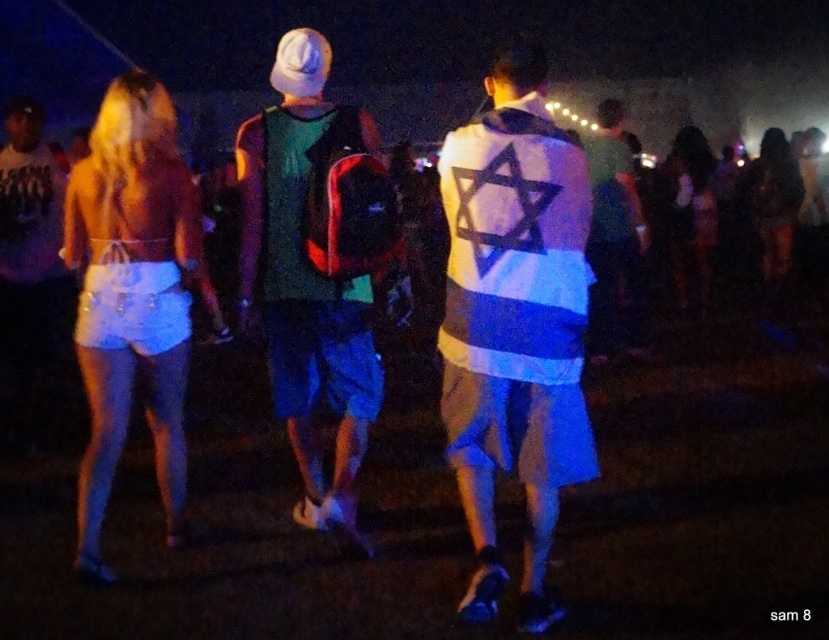
Question: Is white fabric vest at center smaller than white satin shorts at left?

Choices:
 (A) yes
 (B) no

Answer: (A)

Question: Which object appears farthest from the camera in this image?

Choices:
 (A) white satin shorts at left
 (B) green fabric shirt at center

Answer: (A)

Question: Can you confirm if green fabric shirt at center is positioned below white satin shorts at left?

Choices:
 (A) no
 (B) yes

Answer: (A)

Question: Which point is farther to the camera?

Choices:
 (A) white fabric vest at center
 (B) white satin shorts at left

Answer: (B)

Question: Can you confirm if white fabric vest at center is positioned to the left of green fabric shirt at center?

Choices:
 (A) yes
 (B) no

Answer: (B)

Question: Which object appears farthest from the camera in this image?

Choices:
 (A) white fabric vest at center
 (B) white satin shorts at left
 (C) green fabric shirt at center

Answer: (B)